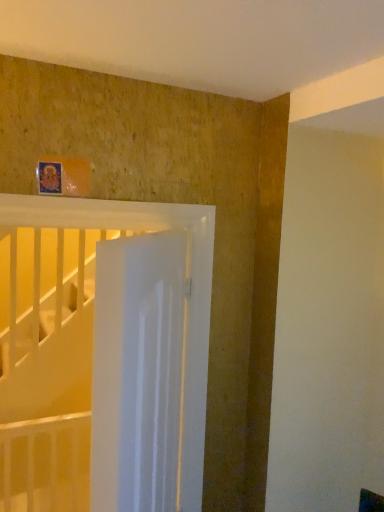
Question: Does white glossy door at center appear on the left side of white glossy bed at upper center?

Choices:
 (A) no
 (B) yes

Answer: (A)

Question: Is white glossy door at center directly adjacent to white glossy bed at upper center?

Choices:
 (A) yes
 (B) no

Answer: (B)

Question: From a real-world perspective, is white glossy door at center on white glossy bed at upper center?

Choices:
 (A) no
 (B) yes

Answer: (A)

Question: Is white glossy door at center located outside white glossy bed at upper center?

Choices:
 (A) yes
 (B) no

Answer: (A)

Question: Is white glossy door at center taller than white glossy bed at upper center?

Choices:
 (A) yes
 (B) no

Answer: (B)

Question: Is white glossy door at center in front of white glossy bed at upper center?

Choices:
 (A) yes
 (B) no

Answer: (A)

Question: From a real-world perspective, is white glossy bed at upper center below white glossy door at center?

Choices:
 (A) yes
 (B) no

Answer: (B)

Question: Is white glossy bed at upper center looking in the opposite direction of white glossy door at center?

Choices:
 (A) yes
 (B) no

Answer: (A)

Question: Does white glossy bed at upper center have a greater height compared to white glossy door at center?

Choices:
 (A) yes
 (B) no

Answer: (A)

Question: Is white glossy bed at upper center to the left of white glossy door at center from the viewer's perspective?

Choices:
 (A) no
 (B) yes

Answer: (B)

Question: Can you confirm if white glossy bed at upper center is smaller than white glossy door at center?

Choices:
 (A) no
 (B) yes

Answer: (B)

Question: Can you confirm if white glossy bed at upper center is thinner than white glossy door at center?

Choices:
 (A) no
 (B) yes

Answer: (B)

Question: Is point (140, 272) closer or farther from the camera than point (150, 227)?

Choices:
 (A) farther
 (B) closer

Answer: (B)